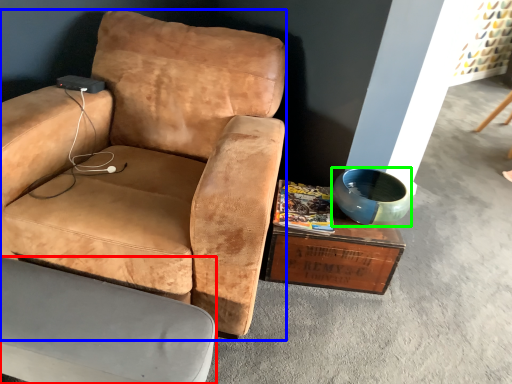
Question: Which object is the closest to the chair (highlighted by a red box)? Choose among these: chair (highlighted by a blue box) or bowl (highlighted by a green box).

Choices:
 (A) chair
 (B) bowl

Answer: (A)